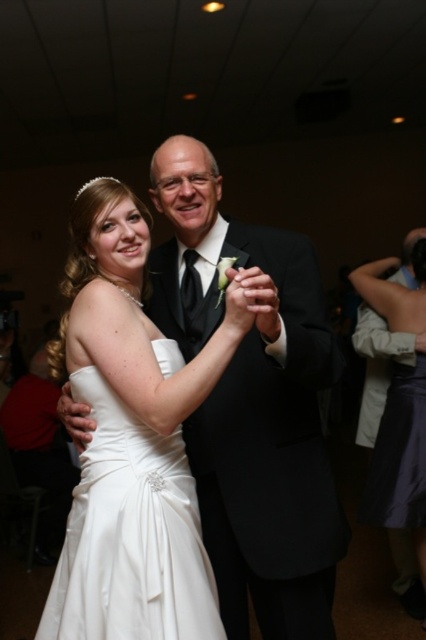
Question: Which of the following is the closest to the observer?

Choices:
 (A) (98, 404)
 (B) (391, 477)

Answer: (A)

Question: Does white satin dress at center appear on the left side of satin purple dress at lower right?

Choices:
 (A) no
 (B) yes

Answer: (B)

Question: Does white satin dress at center come in front of satin purple dress at lower right?

Choices:
 (A) no
 (B) yes

Answer: (B)

Question: Is white satin dress at center smaller than satin purple dress at lower right?

Choices:
 (A) no
 (B) yes

Answer: (B)

Question: Which of the following is the farthest from the observer?

Choices:
 (A) white satin dress at center
 (B) satin purple dress at lower right

Answer: (B)